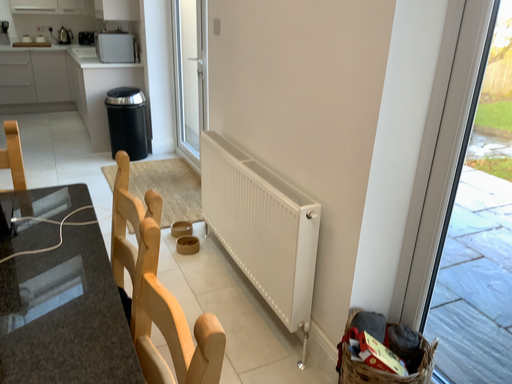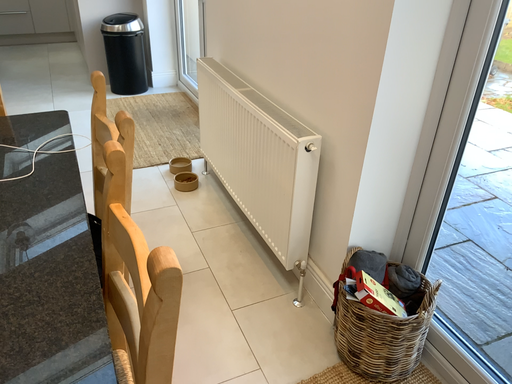
Question: Which way did the camera rotate in the video?

Choices:
 (A) rotated downward
 (B) rotated upward

Answer: (A)